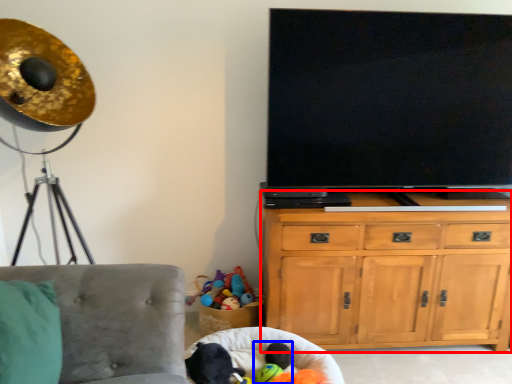
Question: Which point is further to the camera, cabinetry (highlighted by a red box) or toy (highlighted by a blue box)?

Choices:
 (A) cabinetry
 (B) toy

Answer: (A)